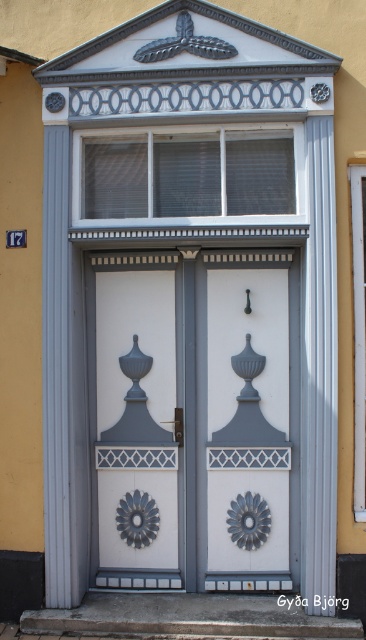
You are a painter hired to paint the facade of the building. You have a ladder that can reach up to 2 meters. The white painted wood door at center is 2.5 meters tall. Can you paint the entire clear glass window at upper center with your ladder?

The white painted wood door at center is taller than the clear glass window at upper center. Since the door is 2.5 meters tall, the window must be shorter than that. If your ladder can reach up to 2 meters, you can paint the entire clear glass window at upper center as long as the window is within the ladder height limit.